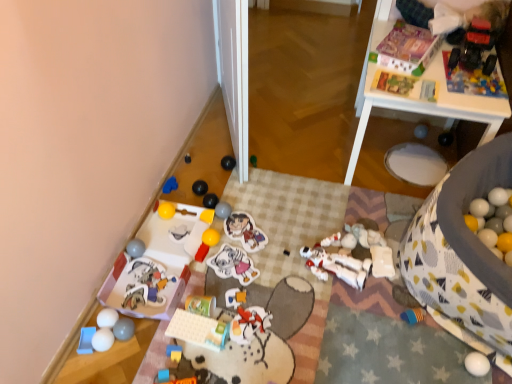
Identify the location of vacant space to the right of yellow rubber ball at center, the 16th toy positioned from the left. (250, 246).